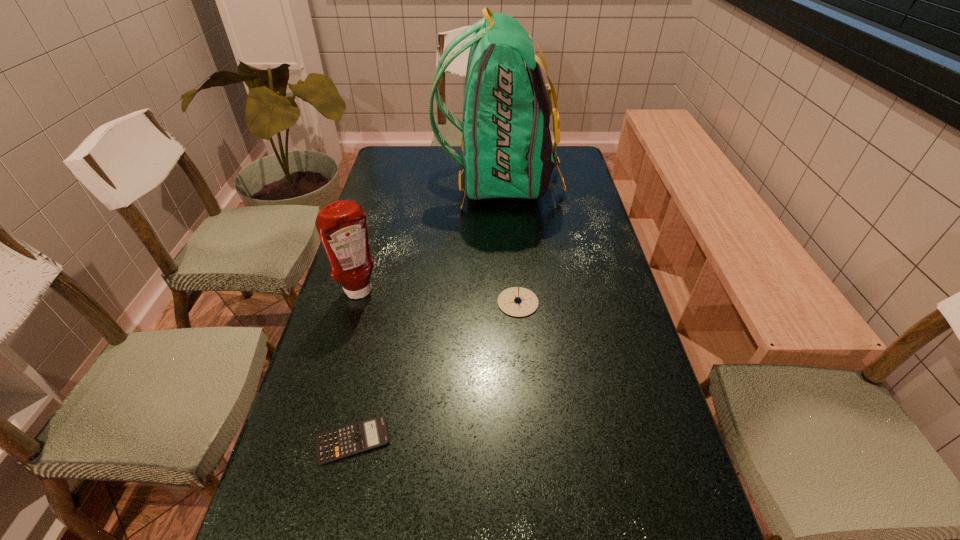
Point out which object is positioned as the second nearest to the backpack. Please provide its 2D coordinates. Your answer should be formatted as a tuple, i.e. [(x, y)], where the tuple contains the x and y coordinates of a point satisfying the conditions above.

[(516, 301)]

This screenshot has width=960, height=540. In order to click on object that stands as the closest to the condiment in this screenshot , I will do `click(516, 301)`.

Locate an element on the screen. The height and width of the screenshot is (540, 960). free space that satisfies the following two spatial constraints: 1. on the back of the compass; 2. on the right side of the backpack is located at coordinates (507, 302).

Identify the location of free space that satisfies the following two spatial constraints: 1. on the back of the farthest object; 2. on the back side of the second shortest object. The height and width of the screenshot is (540, 960). (507, 302).

Locate an element on the screen. The height and width of the screenshot is (540, 960). vacant space that satisfies the following two spatial constraints: 1. on the back of the backpack; 2. on the front side of the second tallest object is located at coordinates (506, 292).

Locate an element on the screen. The height and width of the screenshot is (540, 960). free point that satisfies the following two spatial constraints: 1. on the back of the tallest object; 2. on the left side of the second shortest object is located at coordinates (507, 302).

This screenshot has height=540, width=960. Find the location of `free space that satisfies the following two spatial constraints: 1. on the back of the farthest object; 2. on the front side of the calculator`. free space that satisfies the following two spatial constraints: 1. on the back of the farthest object; 2. on the front side of the calculator is located at coordinates (516, 440).